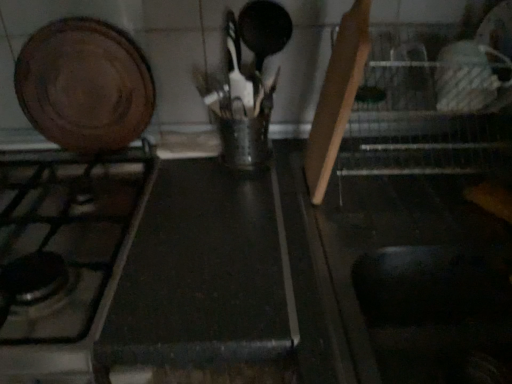
Locate an element on the screen. unoccupied area in front of wooden cutting board at upper left is located at coordinates (76, 188).